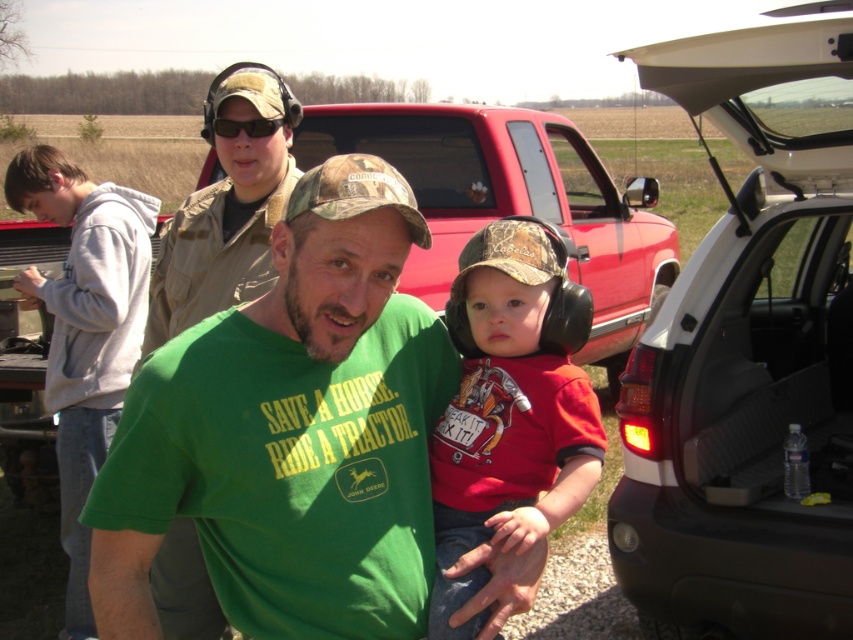
Is green cotton t-shirt at center shorter than gray hoodie at left?

Correct, green cotton t-shirt at center is not as tall as gray hoodie at left.

The image size is (853, 640). Identify the location of green cotton t-shirt at center. (291, 433).

This screenshot has width=853, height=640. Identify the location of green cotton t-shirt at center. (291, 433).

Is green cotton t-shirt at center bigger than black plastic car at right?

Actually, green cotton t-shirt at center might be smaller than black plastic car at right.

Is green cotton t-shirt at center to the right of black plastic car at right from the viewer's perspective?

No, green cotton t-shirt at center is not to the right of black plastic car at right.

Is point (445, 396) farther from camera compared to point (767, 474)?

No, (445, 396) is closer to viewer.

Where is `green cotton t-shirt at center`? The height and width of the screenshot is (640, 853). green cotton t-shirt at center is located at coordinates (291, 433).

How much distance is there between green cotton t-shirt at center and khaki fabric truck at upper center?

green cotton t-shirt at center is 33.41 inches away from khaki fabric truck at upper center.

Is green cotton t-shirt at center shorter than khaki fabric truck at upper center?

Correct, green cotton t-shirt at center is not as tall as khaki fabric truck at upper center.

Describe the element at coordinates (291, 433) in the screenshot. I see `green cotton t-shirt at center` at that location.

Where is `green cotton t-shirt at center`? green cotton t-shirt at center is located at coordinates (291, 433).